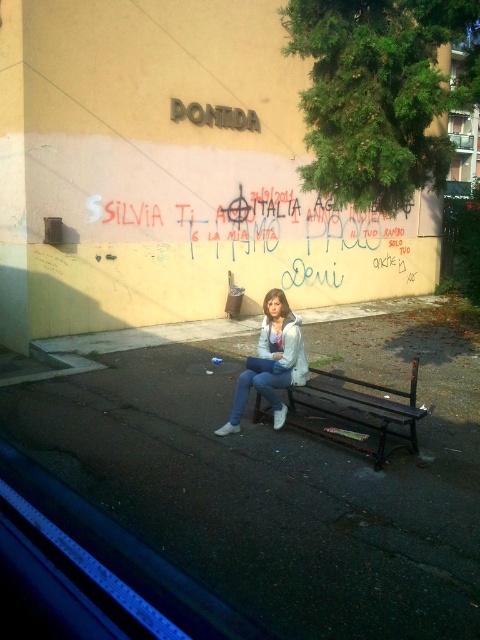
You are a photographer positioned inside a car and want to capture a photo of the dark brown wooden bench at center without including the red graffiti at center in the shot. Based on their positions, is this possible?

The red graffiti at center is to the left of dark brown wooden bench at center, so you can adjust the camera angle to exclude the red graffiti at center by focusing on the right side of the dark brown wooden bench at center.

You are a painter standing at the edge of the vehicle window frame at bottom left. You want to paint the red graffiti at center and the white matte jacket at center. Which object is farther from you?

The red graffiti at center is 7.01 meters away from the white matte jacket at center. Since both are at center, they are equidistant from your position at the window frame. However, the exact distance from you to each isn